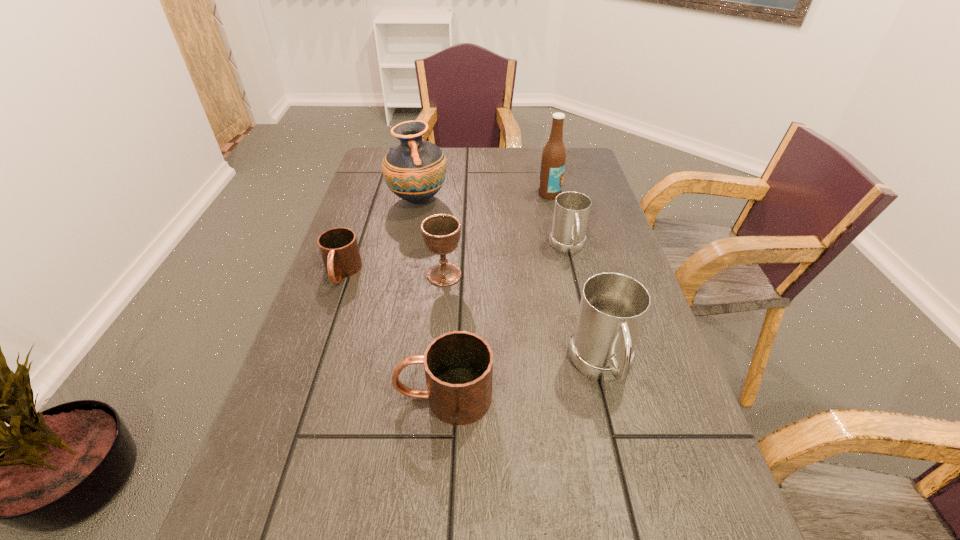
Locate an element on the screen. beer bottle is located at coordinates (553, 160).

At what (x,y) coordinates should I click in order to perform the action: click on pottery. Please return your answer as a coordinate pair (x, y). The image size is (960, 540). Looking at the image, I should click on (415, 170).

The width and height of the screenshot is (960, 540). Identify the location of the nearer gray mug. (613, 307).

The height and width of the screenshot is (540, 960). In order to click on the tallest mug in this screenshot , I will do `click(613, 307)`.

Identify the location of chalice. The width and height of the screenshot is (960, 540). (441, 233).

You are a GUI agent. You are given a task and a screenshot of the screen. Output one action in this format:
    pyautogui.click(x=<x>, y=<y>)
    Task: Click on the smaller gray mug
    
    Given the screenshot: What is the action you would take?
    pyautogui.click(x=571, y=213)

Locate an element on the screen. the third mug from right to left is located at coordinates (458, 365).

The image size is (960, 540). Find the location of `the nearer rust mug`. the nearer rust mug is located at coordinates click(x=458, y=365).

The height and width of the screenshot is (540, 960). In order to click on the leftmost mug in this screenshot , I will do `click(339, 250)`.

Locate an element on the screen. The width and height of the screenshot is (960, 540). the shortest object is located at coordinates (339, 250).